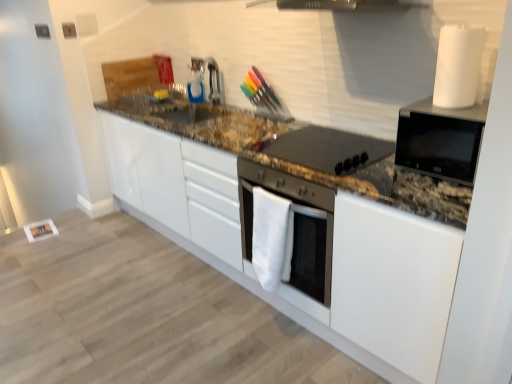
Question: Considering the relative sizes of satin nickel faucet at upper center and white fabric oven at center, the second home appliance positioned from the top, in the image provided, is satin nickel faucet at upper center smaller than white fabric oven at center, the second home appliance positioned from the top,?

Choices:
 (A) no
 (B) yes

Answer: (B)

Question: From the image's perspective, is satin nickel faucet at upper center located beneath white fabric oven at center, the first home appliance when ordered from left to right?

Choices:
 (A) no
 (B) yes

Answer: (A)

Question: From the image's perspective, is satin nickel faucet at upper center on white fabric oven at center, which is the second home appliance from right to left?

Choices:
 (A) yes
 (B) no

Answer: (A)

Question: Is satin nickel faucet at upper center to the left of white fabric oven at center, the second home appliance positioned from the top, from the viewer's perspective?

Choices:
 (A) yes
 (B) no

Answer: (A)

Question: Is white fabric oven at center, the second home appliance positioned from the top, completely or partially inside satin nickel faucet at upper center?

Choices:
 (A) yes
 (B) no

Answer: (B)

Question: Does satin nickel faucet at upper center appear on the right side of white fabric oven at center, placed as the 1th home appliance when sorted from bottom to top?

Choices:
 (A) yes
 (B) no

Answer: (B)

Question: From a real-world perspective, is granite at center located higher than black glossy microwave at upper right, placed as the first home appliance when sorted from right to left?

Choices:
 (A) yes
 (B) no

Answer: (B)

Question: Can you confirm if granite at center is bigger than black glossy microwave at upper right, placed as the first home appliance when sorted from right to left?

Choices:
 (A) no
 (B) yes

Answer: (B)

Question: From the image's perspective, is granite at center under black glossy microwave at upper right, acting as the second home appliance starting from the left?

Choices:
 (A) no
 (B) yes

Answer: (B)

Question: Is granite at center turned away from black glossy microwave at upper right, acting as the second home appliance starting from the left?

Choices:
 (A) yes
 (B) no

Answer: (B)

Question: Can you confirm if granite at center is positioned to the left of black glossy microwave at upper right, acting as the second home appliance starting from the left?

Choices:
 (A) no
 (B) yes

Answer: (B)

Question: Is black glossy microwave at upper right, which appears as the 2th home appliance when ordered from the bottom, inside granite at center?

Choices:
 (A) no
 (B) yes

Answer: (A)

Question: Considering the relative sizes of black matte stovetop at center and white fabric oven at center, which is the second home appliance from right to left, in the image provided, is black matte stovetop at center smaller than white fabric oven at center, which is the second home appliance from right to left,?

Choices:
 (A) yes
 (B) no

Answer: (A)